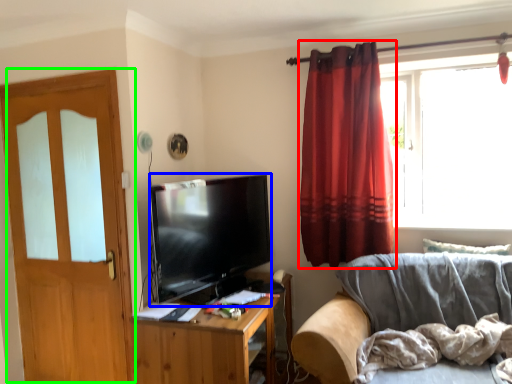
Question: Which is farther away from curtain (highlighted by a red box)? television (highlighted by a blue box) or door (highlighted by a green box)?

Choices:
 (A) television
 (B) door

Answer: (B)